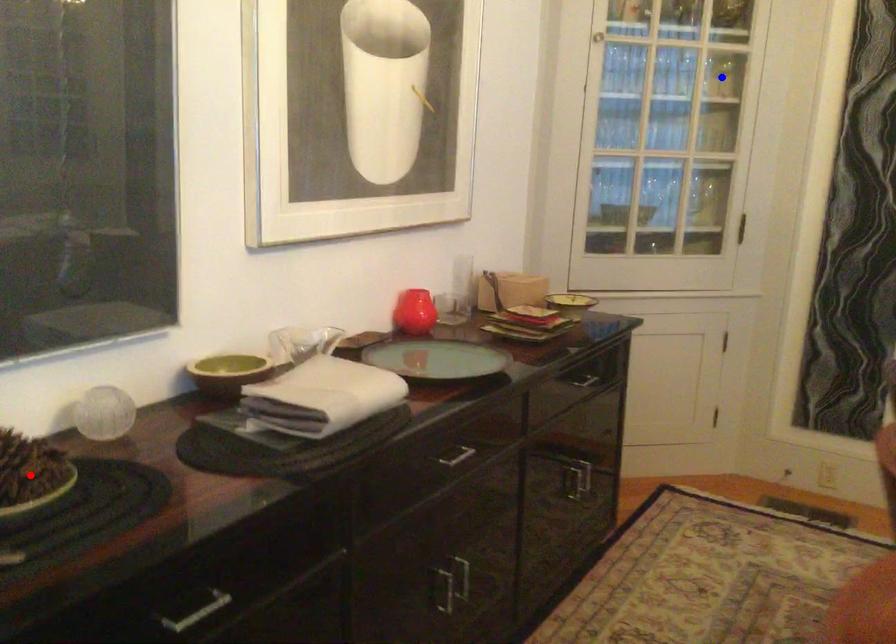
Question: In the image, two points are highlighted. Which point is nearer to the camera? Reply with the corresponding letter.

Choices:
 (A) blue point
 (B) red point

Answer: (B)